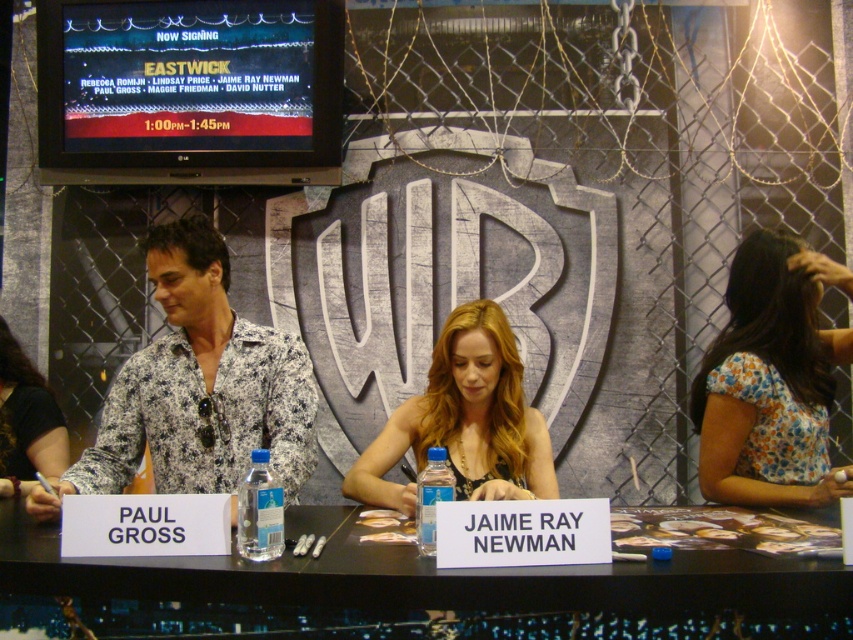
You are attending a signing event and notice two attendees wearing different shirts. The floral fabric blouse at right and the black fabric shirt at left. From your perspective, which one is positioned higher?

The floral fabric blouse at right is positioned higher than the black fabric shirt at left.

In the signing event scene with Warner Bros. backdrop, where is the floral fabric blouse at right located?

The floral fabric blouse at right is located at point (x=770, y=380).